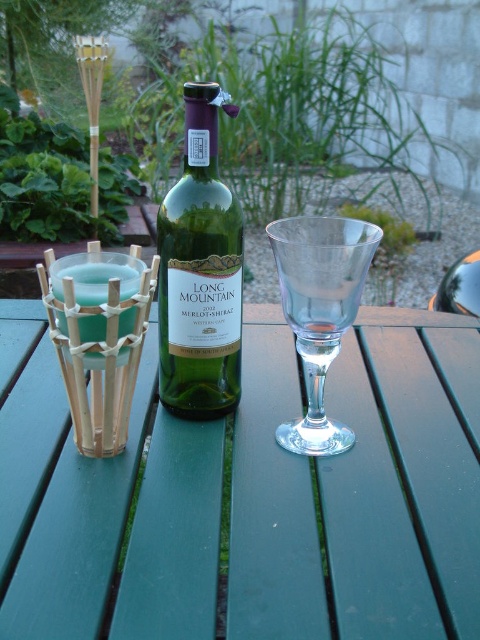
You are setting up a picnic table for a dinner party and need to place a centerpiece. Given the green painted wood picnic table at center and the green glass bottle at center, which object is wider and thus better suited for holding the centerpiece?

The green painted wood picnic table at center is wider than the green glass bottle at center, so the picnic table is better suited for holding the centerpiece.